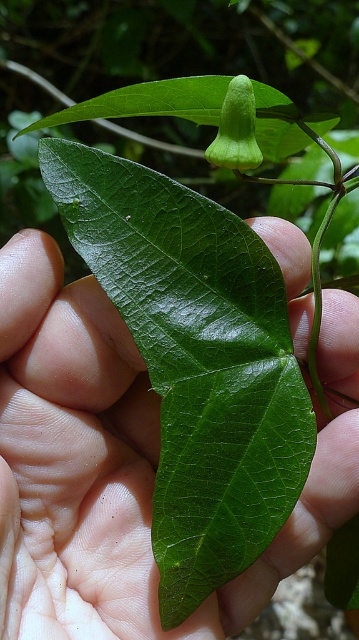
Between green glossy leaf at center and green matte flower at upper center, which one appears on the left side from the viewer's perspective?

From the viewer's perspective, green glossy leaf at center appears more on the left side.

How far apart are green glossy leaf at center and green matte flower at upper center?

The distance of green glossy leaf at center from green matte flower at upper center is 18.81 centimeters.

Where is `green glossy leaf at center`? The image size is (359, 640). green glossy leaf at center is located at coordinates (196, 362).

At what (x,y) coordinates should I click in order to perform the action: click on green glossy leaf at center. Please return your answer as a coordinate pair (x, y). This screenshot has height=640, width=359. Looking at the image, I should click on (196, 362).